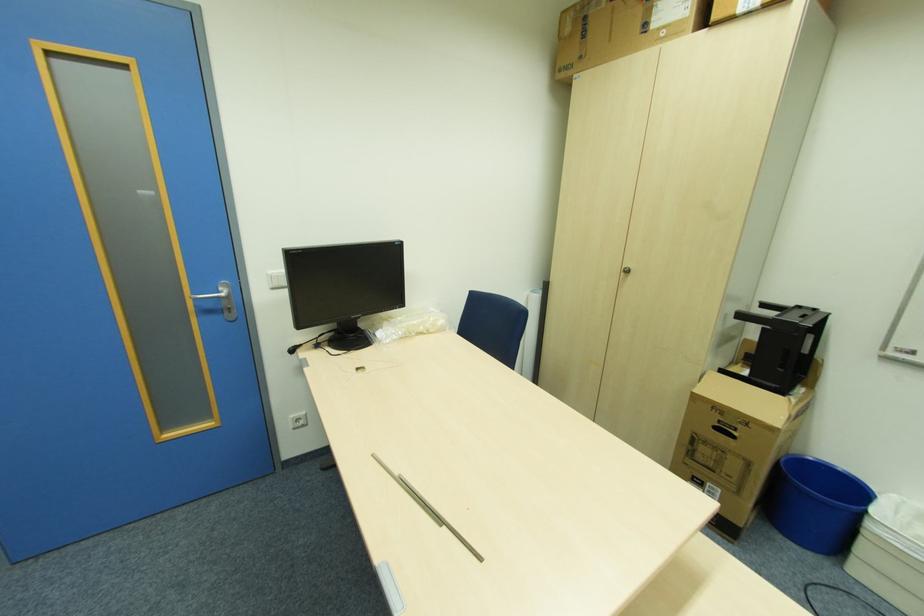
The height and width of the screenshot is (616, 924). What are the coordinates of `clear plastic bag` in the screenshot? It's located at (407, 323).